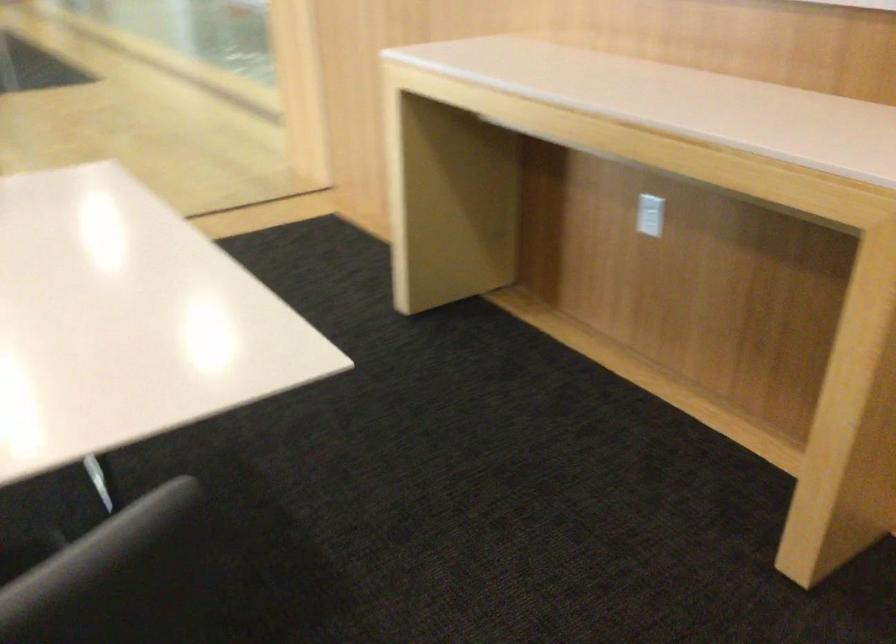
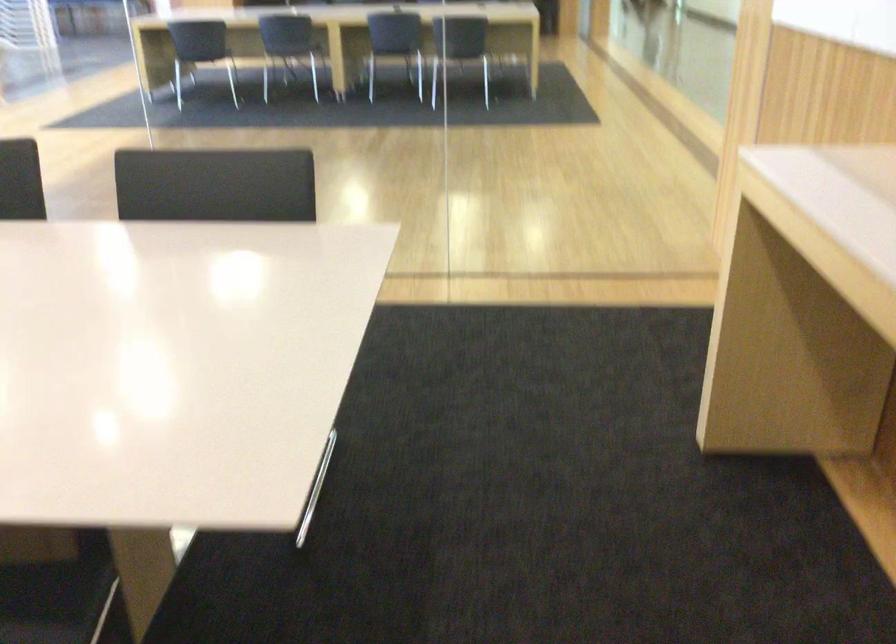
Question: The camera is either moving clockwise (left) or counter-clockwise (right) around the object. The first image is from the beginning of the video and the second image is from the end. Is the camera moving left or right when shooting the video?

Choices:
 (A) Left
 (B) Right

Answer: (B)